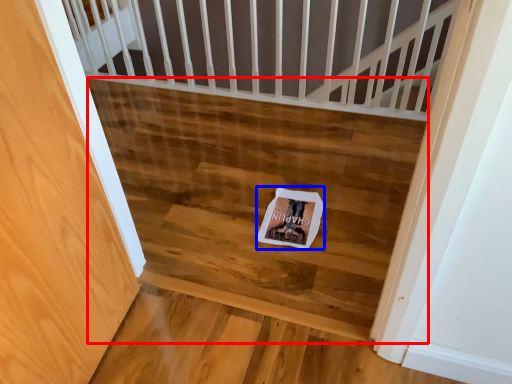
Question: Which of the following is the closest to the observer, stairwell (highlighted by a red box) or postcard (highlighted by a blue box)?

Choices:
 (A) stairwell
 (B) postcard

Answer: (A)